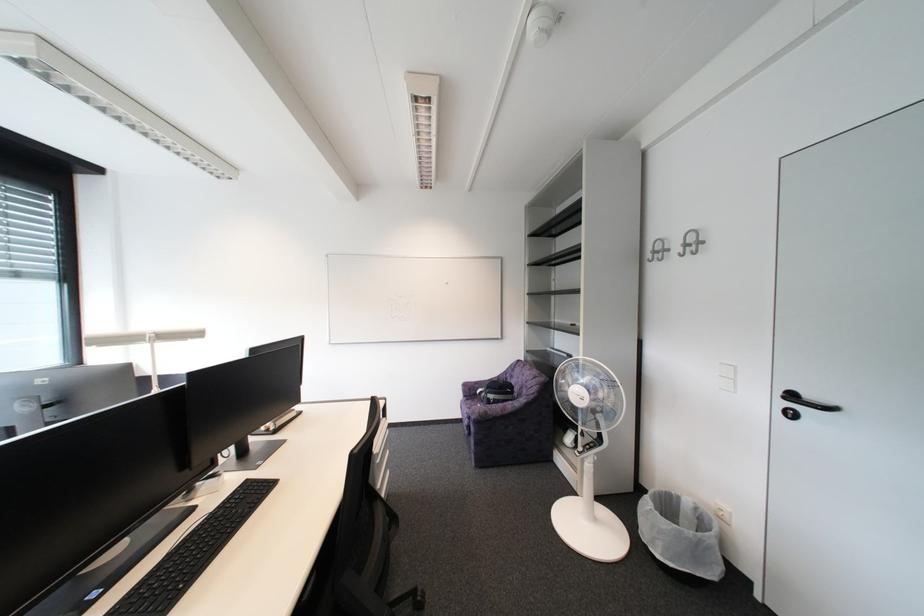
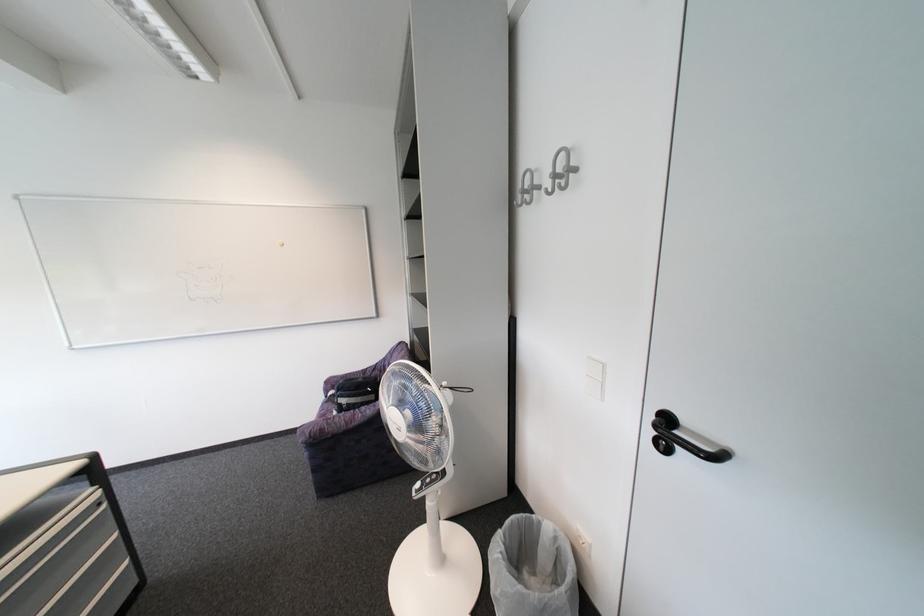
Question: The camera is either moving clockwise (left) or counter-clockwise (right) around the object. The first image is from the beginning of the video and the second image is from the end. Is the camera moving left or right when shooting the video?

Choices:
 (A) Left
 (B) Right

Answer: (A)